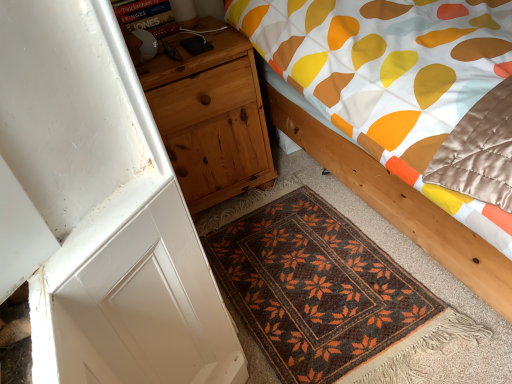
The height and width of the screenshot is (384, 512). I want to click on vacant region above brown woven mat at lower center (from a real-world perspective), so click(278, 282).